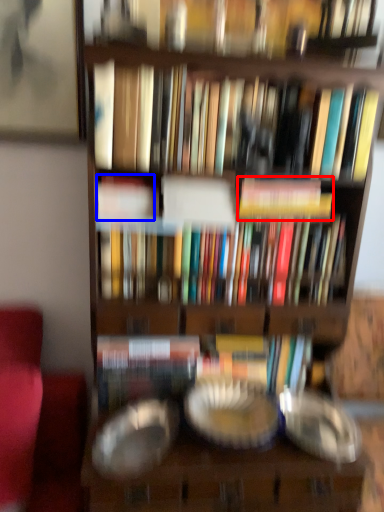
Question: Among these objects, which one is farthest to the camera, book (highlighted by a red box) or book (highlighted by a blue box)?

Choices:
 (A) book
 (B) book

Answer: (A)